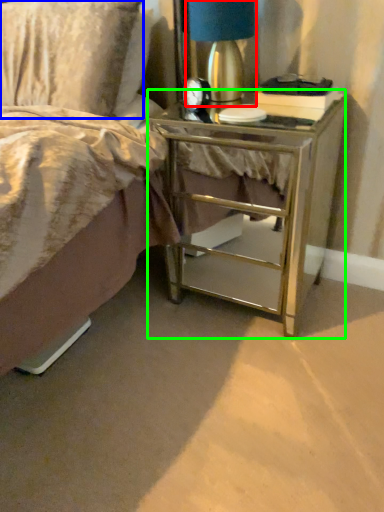
Question: Which object is the closest to the bedside lamp (highlighted by a red box)? Choose among these: pillow (highlighted by a blue box) or nightstand (highlighted by a green box).

Choices:
 (A) pillow
 (B) nightstand

Answer: (A)